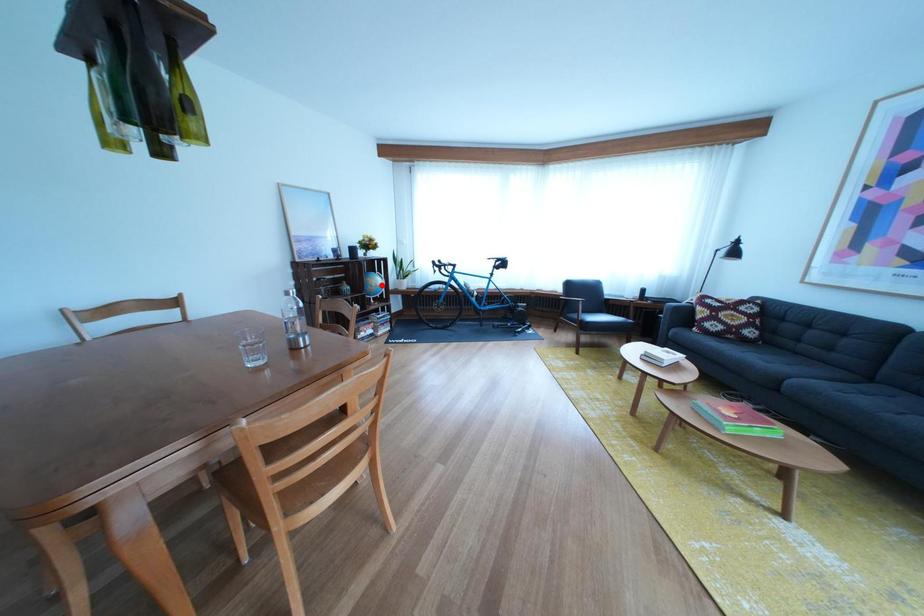
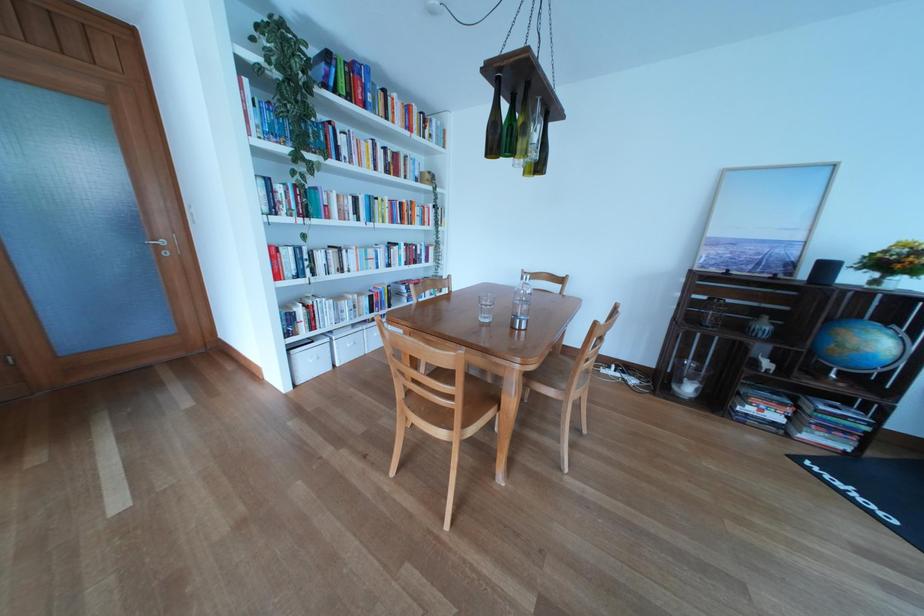
Locate, in the second image, the point that corresponds to the highlighted location in the first image.

(855, 337)